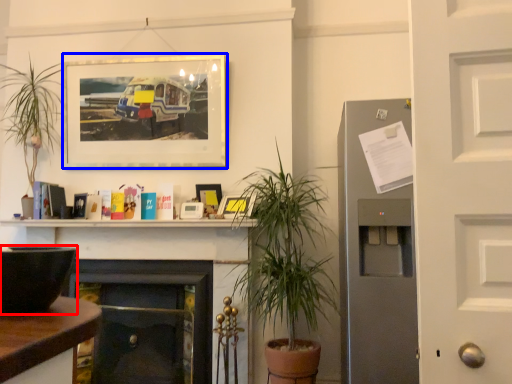
Question: Which object appears farthest to the camera in this image, appliance (highlighted by a red box) or picture frame (highlighted by a blue box)?

Choices:
 (A) appliance
 (B) picture frame

Answer: (B)